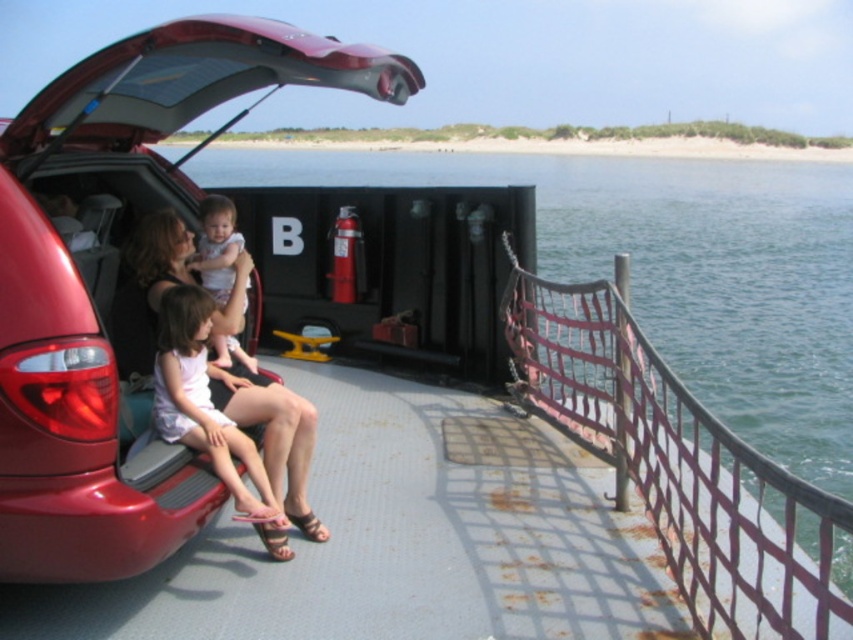
Which of these two, shiny red car at center or matte black shorts at lower left, stands shorter?

Standing shorter between the two is shiny red car at center.

Is shiny red car at center behind matte black shorts at lower left?

No, shiny red car at center is closer to the viewer.

Does point (83, 470) lie behind point (142, 353)?

No, it is in front of (142, 353).

Locate an element on the screen. The image size is (853, 640). shiny red car at center is located at coordinates point(117,280).

Is the position of clear water at center more distant than that of rusty metal rail at right?

That is True.

Does clear water at center have a greater width compared to rusty metal rail at right?

Yes.

The height and width of the screenshot is (640, 853). Identify the location of clear water at center. (677, 268).

The image size is (853, 640). I want to click on clear water at center, so click(x=677, y=268).

This screenshot has height=640, width=853. Identify the location of rusty metal rail at right. (680, 465).